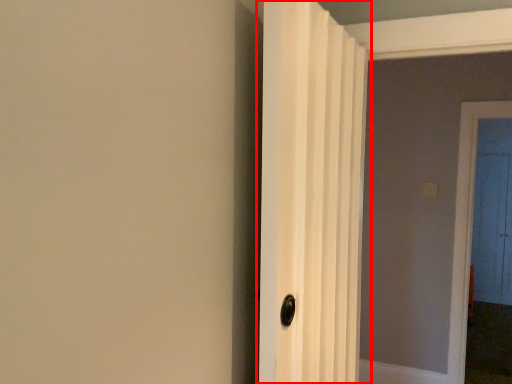
Question: From the image's perspective, where is door (annotated by the red box) located in relation to door in the image?

Choices:
 (A) above
 (B) below

Answer: (A)